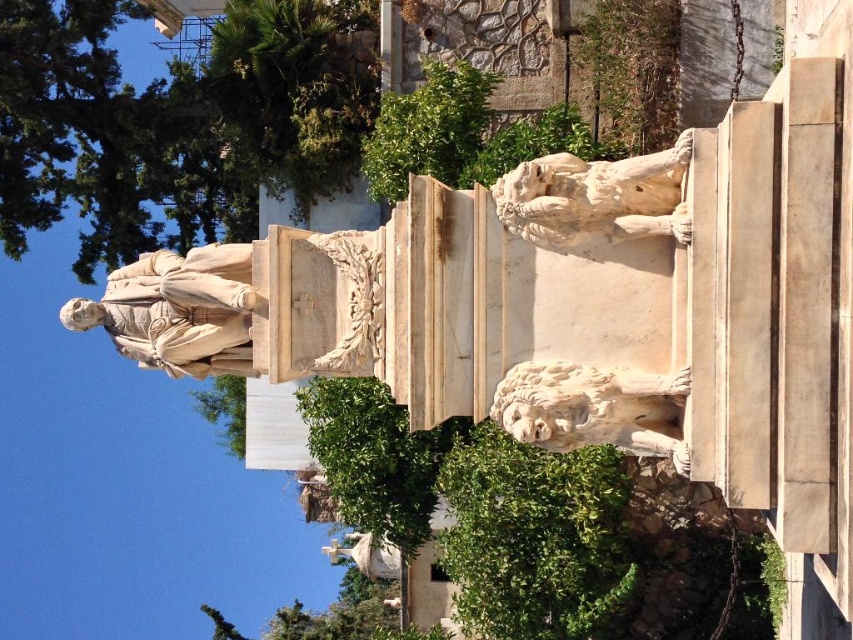
Question: Among these objects, which one is farthest from the camera?

Choices:
 (A) white marble lion at upper right
 (B) white marble statue at center

Answer: (B)

Question: Which point is closer to the camera?

Choices:
 (A) (625, 172)
 (B) (227, 381)
 (C) (195, 296)
 (D) (518, 436)

Answer: (A)

Question: Does white marble lion at right have a larger size compared to green leafy tree at center?

Choices:
 (A) yes
 (B) no

Answer: (B)

Question: Estimate the real-world distances between objects in this image. Which object is farther from the white marble lion at upper right?

Choices:
 (A) green leafy bush at lower center
 (B) green leafy tree at center
 (C) white marble statue at center
 (D) white marble lion at right

Answer: (B)

Question: Is green leafy bush at lower center to the left of white marble lion at right from the viewer's perspective?

Choices:
 (A) no
 (B) yes

Answer: (A)

Question: Is green leafy bush at lower center above white marble statue at center?

Choices:
 (A) yes
 (B) no

Answer: (B)